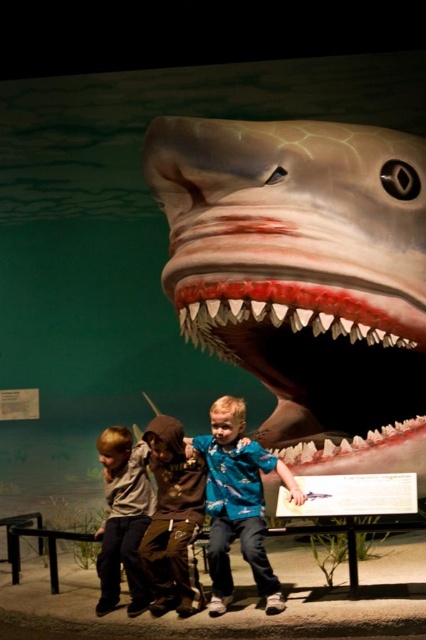
Which is below, brown cotton hoodie at center or brown leather jacket at lower left?

Positioned lower is brown leather jacket at lower left.

How far apart are brown cotton hoodie at center and brown leather jacket at lower left?

9.95 inches

Is point (158, 580) positioned in front of point (115, 509)?

Yes, it is in front of point (115, 509).

I want to click on brown cotton hoodie at center, so click(x=172, y=520).

Can you confirm if blue fabric shirt at center is positioned to the left of brown cotton hoodie at center?

No, blue fabric shirt at center is not to the left of brown cotton hoodie at center.

Is blue fabric shirt at center further to the viewer compared to brown cotton hoodie at center?

No, it is in front of brown cotton hoodie at center.

Is point (221, 589) behind point (166, 496)?

No.

In order to click on blue fabric shirt at center in this screenshot , I will do point(238,502).

Is point (322, 259) farther from camera compared to point (215, 419)?

No, it is in front of (215, 419).

Which is above, smooth gray shark at center or blue fabric shirt at center?

Positioned higher is smooth gray shark at center.

Which is behind, point (336, 432) or point (244, 452)?

Point (336, 432)

Image resolution: width=426 pixels, height=640 pixels. I want to click on smooth gray shark at center, so click(299, 262).